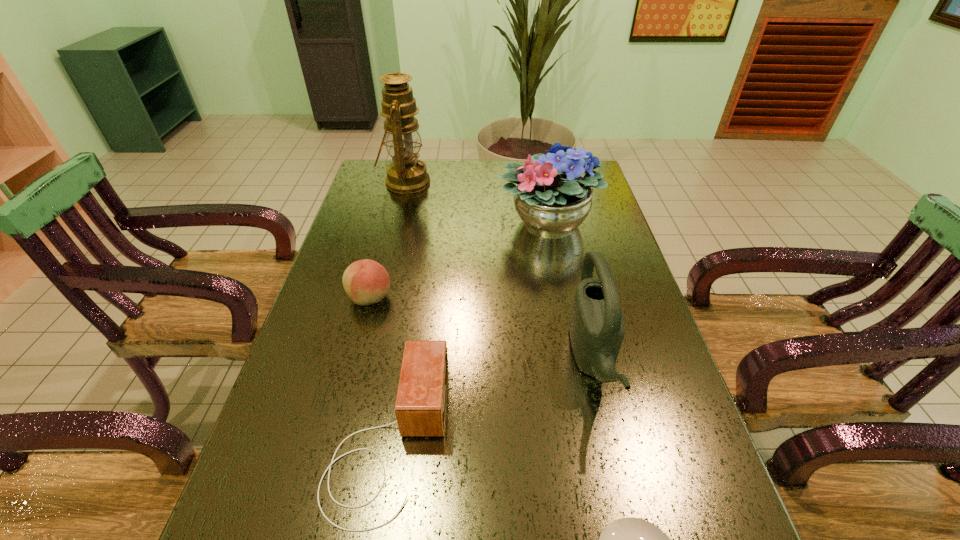
Locate an element on the screen. The height and width of the screenshot is (540, 960). vacant space situated 0.390m on the right of the peach is located at coordinates (540, 298).

Locate an element on the screen. This screenshot has height=540, width=960. free space located on the front-facing side of the radio receiver is located at coordinates tap(500, 438).

Locate an element on the screen. object located at the far edge is located at coordinates (407, 174).

Locate an element on the screen. oil lamp that is at the left edge is located at coordinates (407, 174).

At what (x,y) coordinates should I click in order to perform the action: click on peach situated at the left edge. Please return your answer as a coordinate pair (x, y). This screenshot has height=540, width=960. Looking at the image, I should click on (366, 282).

Locate an element on the screen. radio receiver positioned at the left edge is located at coordinates (420, 409).

Image resolution: width=960 pixels, height=540 pixels. I want to click on bouquet that is at the right edge, so click(x=551, y=197).

The height and width of the screenshot is (540, 960). What are the coordinates of `watering can that is at the right edge` in the screenshot? It's located at (597, 328).

Locate an element on the screen. The image size is (960, 540). object located in the far left corner section of the desktop is located at coordinates (407, 174).

The width and height of the screenshot is (960, 540). In the image, there is a desktop. What are the coordinates of `free region at the far edge` in the screenshot? It's located at (475, 180).